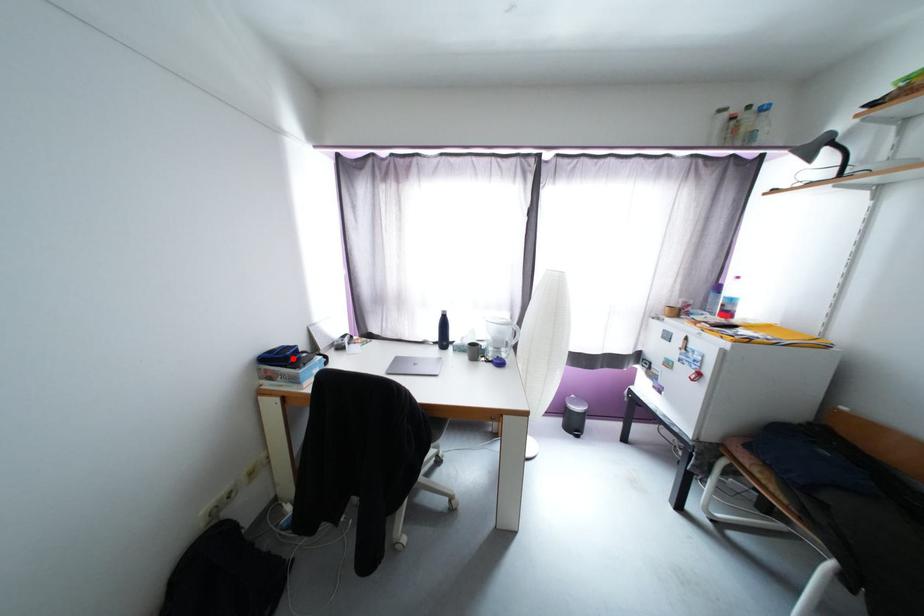
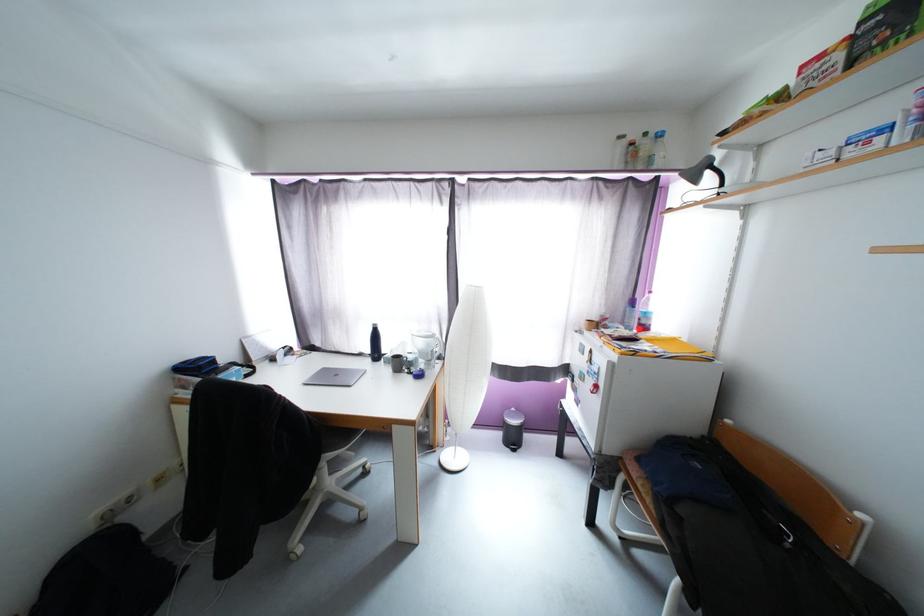
Locate, in the second image, the point that corresponds to the highlighted location in the first image.

(205, 369)